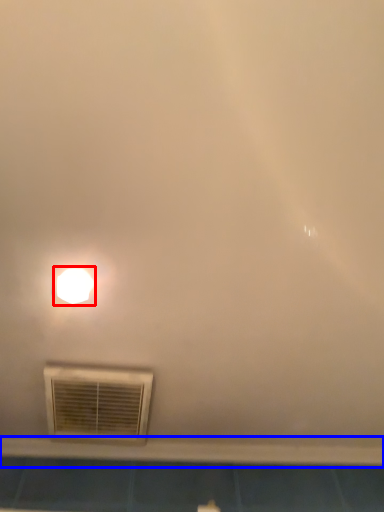
Question: Which of the following is the closest to the observer, lamp (highlighted by a red box) or window sill (highlighted by a blue box)?

Choices:
 (A) lamp
 (B) window sill

Answer: (A)